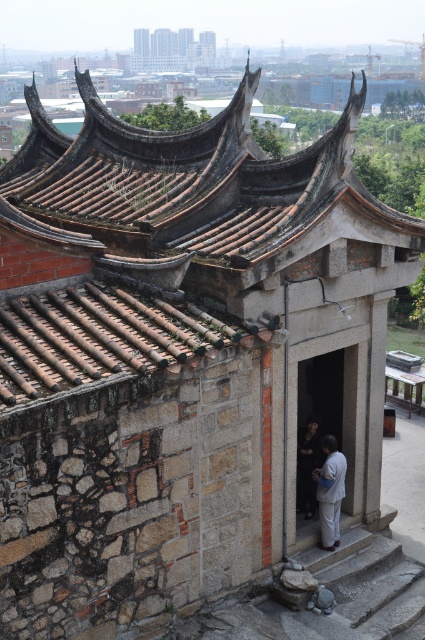
You are standing in front of a traditional Chinese temple and want to take a photo of the brown tiled roof at upper center. If your camera can focus on objects up to 10 meters away, will you need to move closer to get a clear shot?

The brown tiled roof at upper center is 13.37 meters away from the viewer, so you need to move closer to ensure it is within the camera focus range of 10 meters.

You are an architect examining the traditional Chinese building in the image. You notice the brown tiled roof at upper center and the brown stone temple at upper center. Which of these two elements is positioned higher in the image?

The brown tiled roof at upper center is taller than the brown stone temple at upper center, so it is positioned higher in the image.